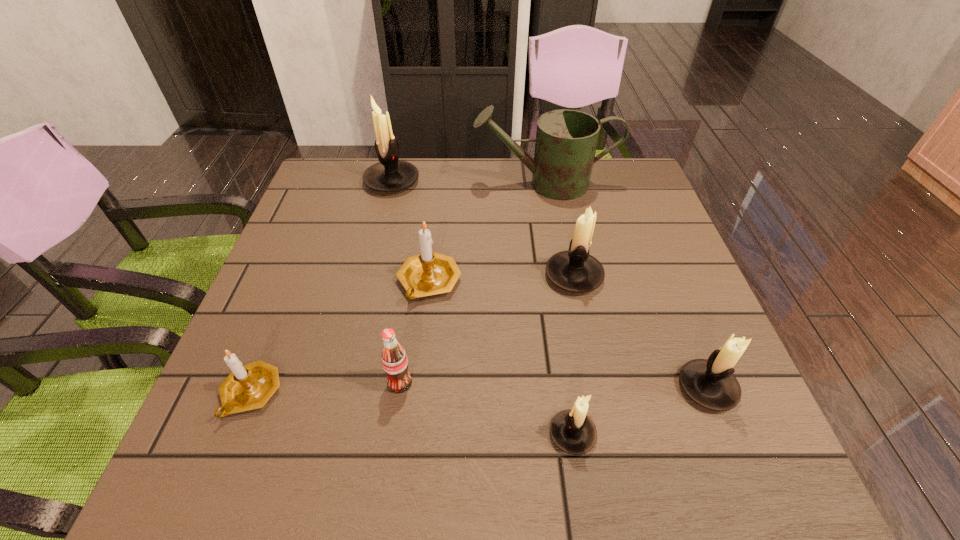
Identify the location of the tallest candle holder. click(390, 174).

Where is `the farthest white candle holder`? The width and height of the screenshot is (960, 540). the farthest white candle holder is located at coordinates (x=390, y=174).

Locate an element on the screen. This screenshot has height=540, width=960. green watering can is located at coordinates [x=566, y=140].

This screenshot has height=540, width=960. Find the location of `the second farthest white candle holder`. the second farthest white candle holder is located at coordinates (574, 270).

The image size is (960, 540). Identify the location of the second biggest white candle holder. (574, 270).

Where is `the right gold candle holder`? Image resolution: width=960 pixels, height=540 pixels. the right gold candle holder is located at coordinates (429, 273).

The width and height of the screenshot is (960, 540). I want to click on the farther gold candle holder, so point(429,273).

This screenshot has height=540, width=960. In order to click on the second smallest white candle holder in this screenshot , I will do `click(710, 383)`.

Locate an element on the screen. This screenshot has height=540, width=960. the rightmost candle holder is located at coordinates (710, 383).

Image resolution: width=960 pixels, height=540 pixels. What are the coordinates of `soda` in the screenshot? It's located at (394, 360).